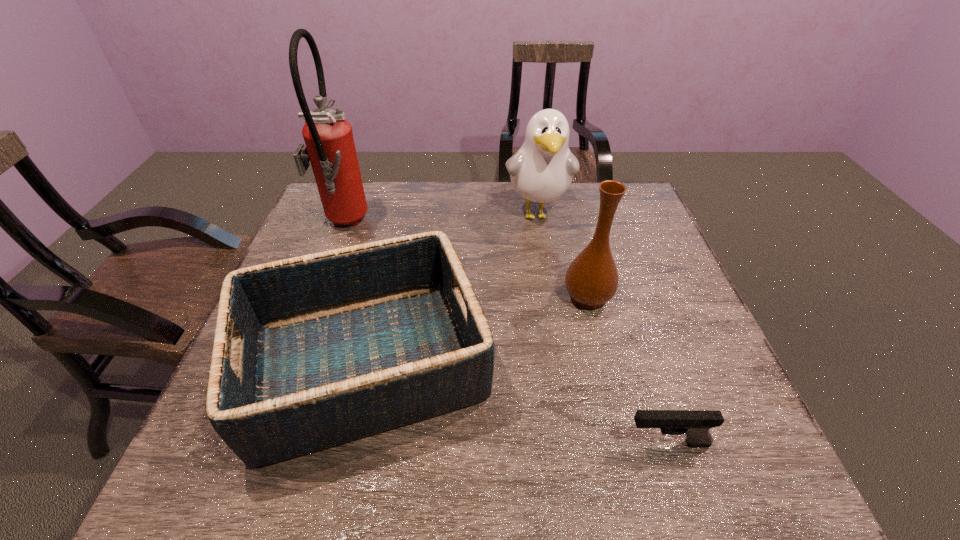
Identify the location of object that is at the near left corner. (326, 348).

Locate an element on the screen. object that is positioned at the near right corner is located at coordinates (695, 424).

Find the location of a particular element. The width and height of the screenshot is (960, 540). free space at the far edge of the desktop is located at coordinates (539, 204).

Where is `vacant space at the near edge`? vacant space at the near edge is located at coordinates (658, 454).

This screenshot has width=960, height=540. Find the location of `vacant space at the left edge of the desktop`. vacant space at the left edge of the desktop is located at coordinates (317, 239).

This screenshot has width=960, height=540. I want to click on vacant region at the near left corner of the desktop, so click(x=198, y=481).

Identify the location of free space at the far right corner of the desktop. (593, 193).

This screenshot has height=540, width=960. I want to click on free spot between the shortest object and the vase, so click(627, 370).

Locate an element on the screen. The width and height of the screenshot is (960, 540). free space between the gull and the shortest object is located at coordinates (602, 328).

Locate an element on the screen. free space between the shortest object and the gull is located at coordinates 602,328.